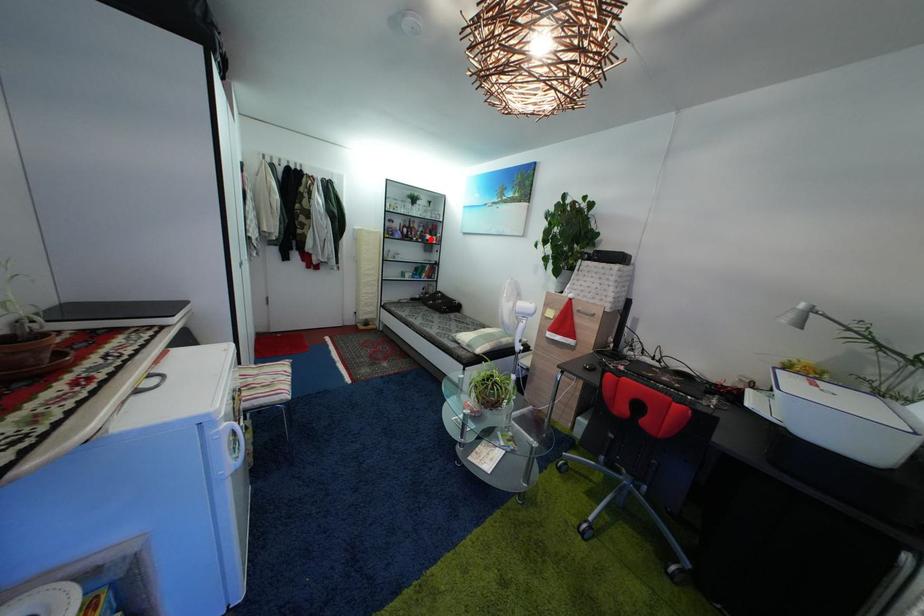
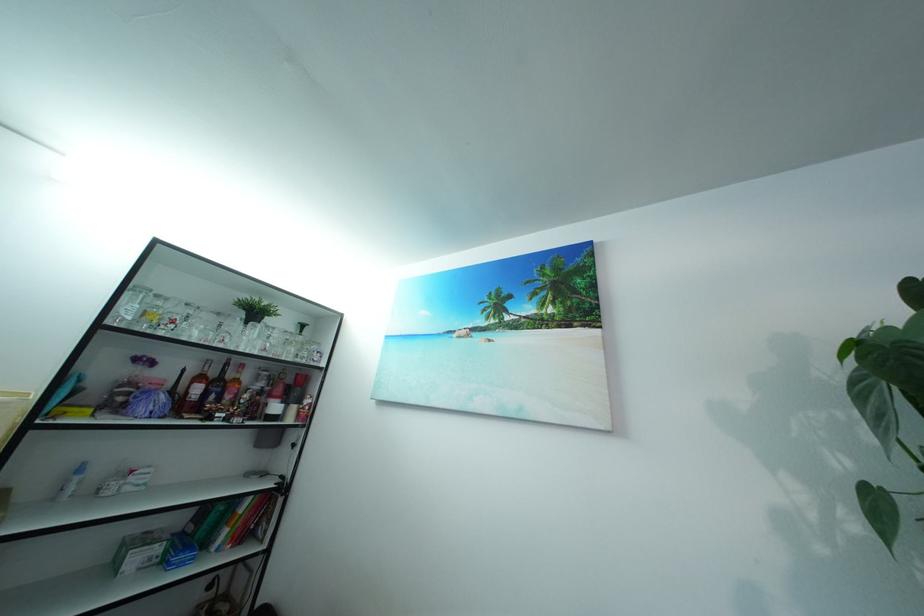
Find the pixel in the second image that matches the highlighted location in the first image.

(269, 400)